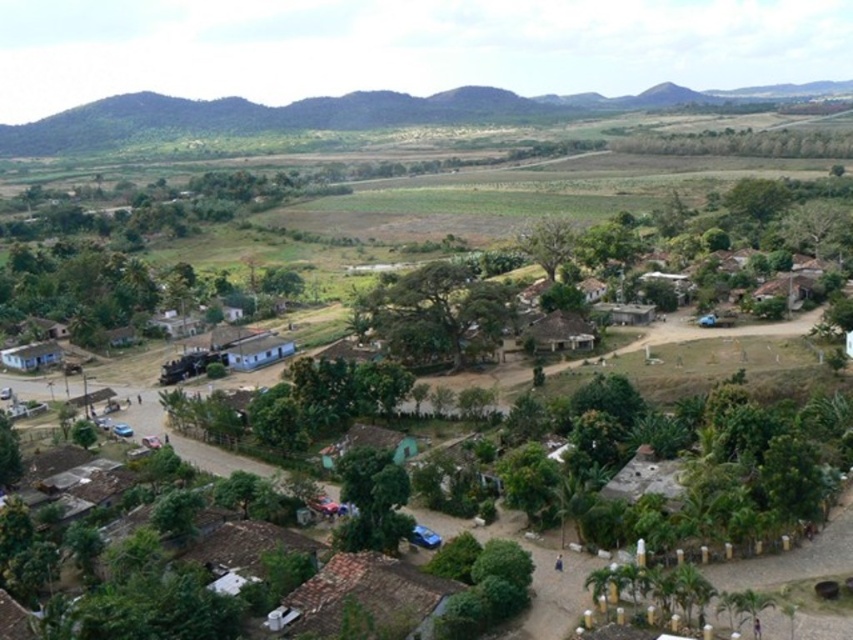
You are standing at the entrance of the village and see the point marked as point (x=558, y=333). What does this point represent in the village?

The point (x=558, y=333) represents the location of the brown thatched roof hut at center.

You are standing at the entrance of the village and see the point marked at coordinates (367, 596). What object is located at that point?

The brown tiled roof at lower center is located at point (367, 596).

You are a visitor in this village and want to find the tallest building between the brown tiled roof at lower center and the brown thatched roof hut at center. Which one should you look for?

The brown thatched roof hut at center is taller than the brown tiled roof at lower center, so you should look for the brown thatched roof hut at center.